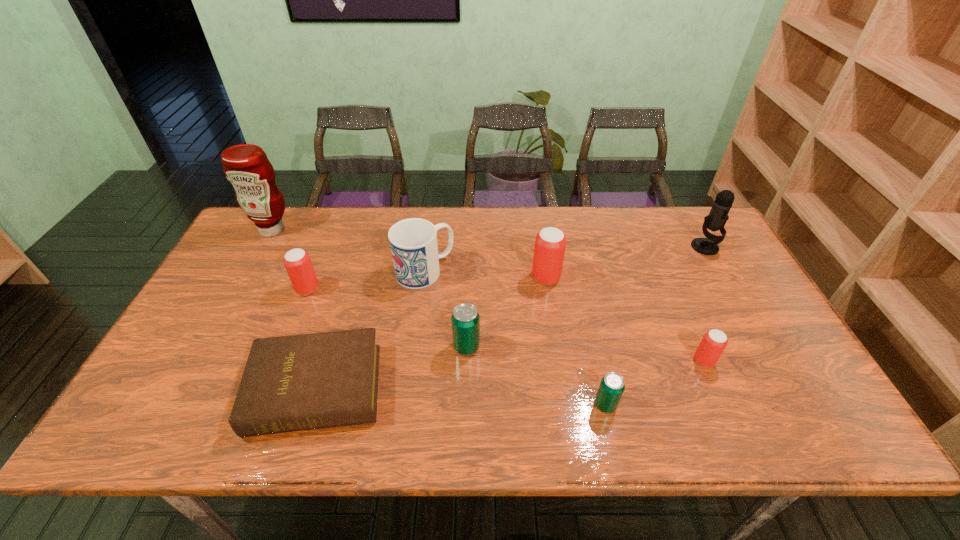
Where is `the farther teal beer can`? The width and height of the screenshot is (960, 540). the farther teal beer can is located at coordinates (465, 319).

Where is `the rightmost beer can`? This screenshot has height=540, width=960. the rightmost beer can is located at coordinates (714, 341).

This screenshot has width=960, height=540. Identify the location of the smallest red beer can. (714, 341).

Where is `the second beer can from right to left`? The height and width of the screenshot is (540, 960). the second beer can from right to left is located at coordinates (612, 385).

Identify the location of the nearer teal beer can. This screenshot has height=540, width=960. (612, 385).

Where is `brown Bible`? The width and height of the screenshot is (960, 540). brown Bible is located at coordinates (292, 383).

This screenshot has width=960, height=540. In order to click on the shortest object in this screenshot , I will do `click(292, 383)`.

The image size is (960, 540). I want to click on free region located 0.050m on the front of the tallest object, so click(x=261, y=250).

You are a GUI agent. You are given a task and a screenshot of the screen. Output one action in this format:
    pyautogui.click(x=<x>, y=<y>)
    Task: Click on the free space located 0.320m on the front of the rightmost object
    The image size is (960, 540).
    Given the screenshot: What is the action you would take?
    pyautogui.click(x=756, y=338)

This screenshot has height=540, width=960. I want to click on free space located 0.170m on the back of the fourth object from right to left, so click(x=539, y=233).